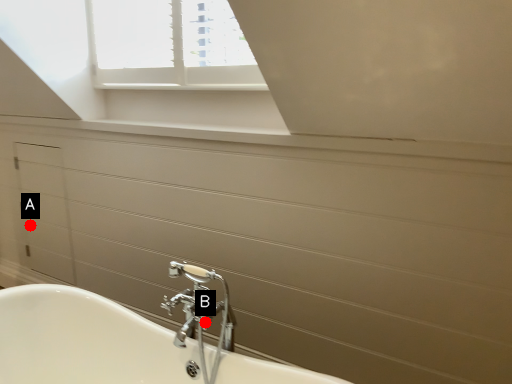
Question: Two points are circled on the image, labeled by A and B beside each circle. Which point appears farthest from the camera in this image?

Choices:
 (A) A is further
 (B) B is further

Answer: (A)